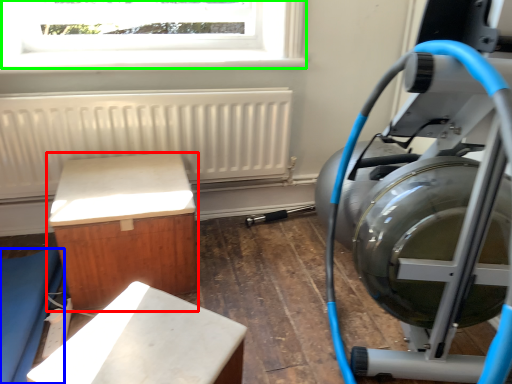
Question: Estimate the real-world distances between objects in this image. Which object is closer to furniture (highlighted by a red box), furniture (highlighted by a blue box) or window (highlighted by a green box)?

Choices:
 (A) furniture
 (B) window

Answer: (A)